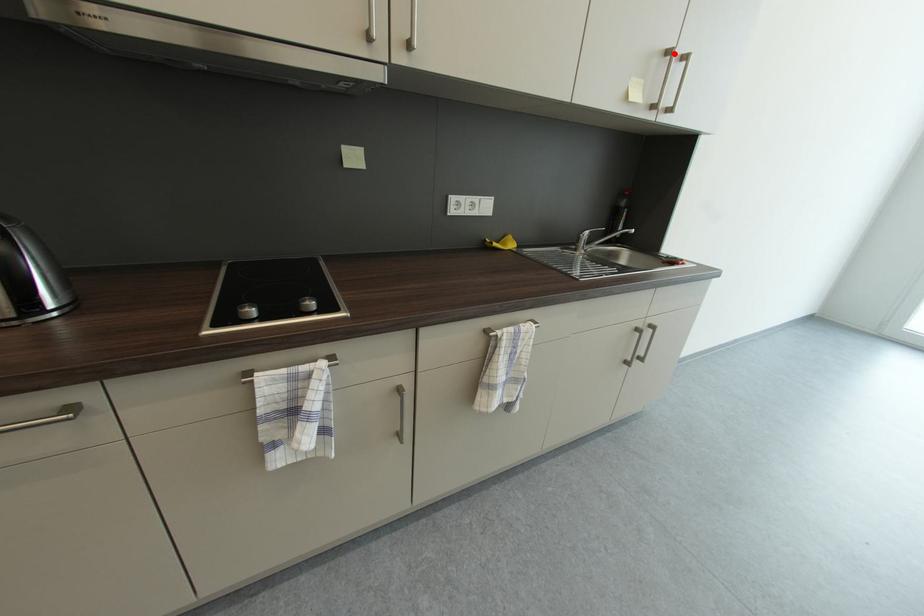
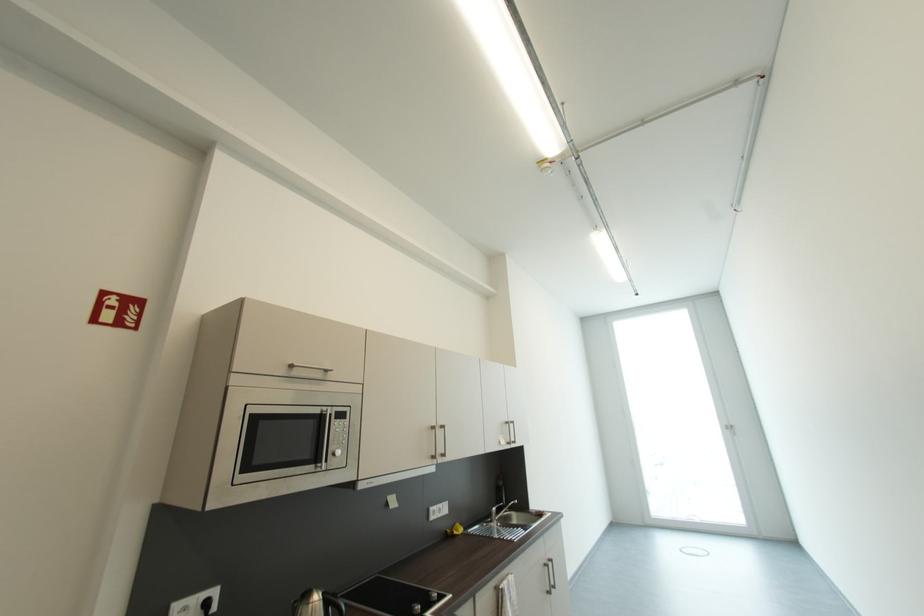
Where in the second image is the point corresponding to the highlighted location from the first image?

(513, 424)